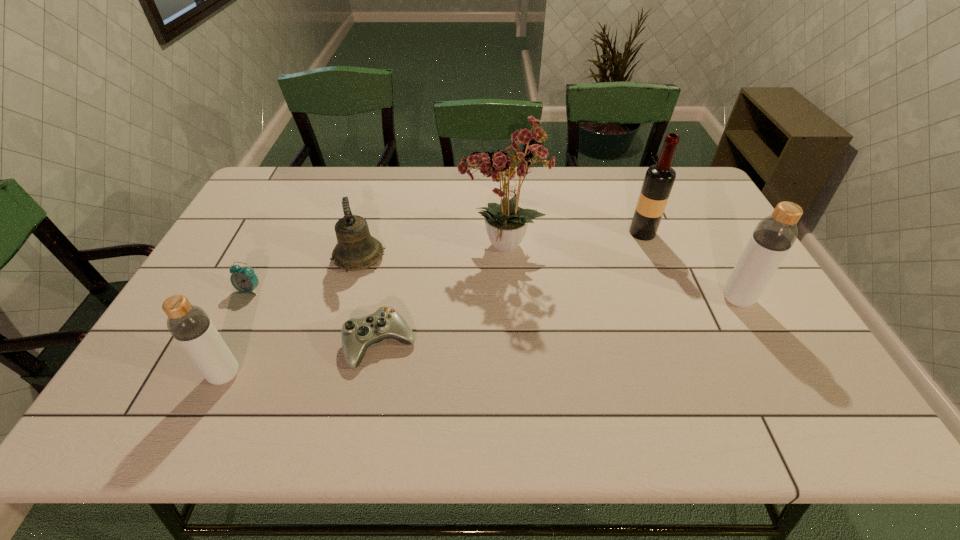
This screenshot has width=960, height=540. In order to click on the nearer bottle in this screenshot , I will do `click(190, 326)`.

Locate an element on the screen. the fourth tallest object is located at coordinates (190, 326).

At what (x,y) coordinates should I click in order to perform the action: click on the taller bottle. Please return your answer as a coordinate pair (x, y). Looking at the image, I should click on (774, 235).

The height and width of the screenshot is (540, 960). Find the location of `the right bottle`. the right bottle is located at coordinates (774, 235).

Identify the location of the second object from right to left. The height and width of the screenshot is (540, 960). (659, 179).

Identify the location of flower arrangement. Image resolution: width=960 pixels, height=540 pixels. (506, 223).

Where is `the third object from right to left`? This screenshot has width=960, height=540. the third object from right to left is located at coordinates (506, 223).

Locate an element on the screen. bell is located at coordinates (356, 249).

Locate an element on the screen. the second shortest object is located at coordinates [244, 280].

Identify the location of the shortest object. The width and height of the screenshot is (960, 540). (358, 334).